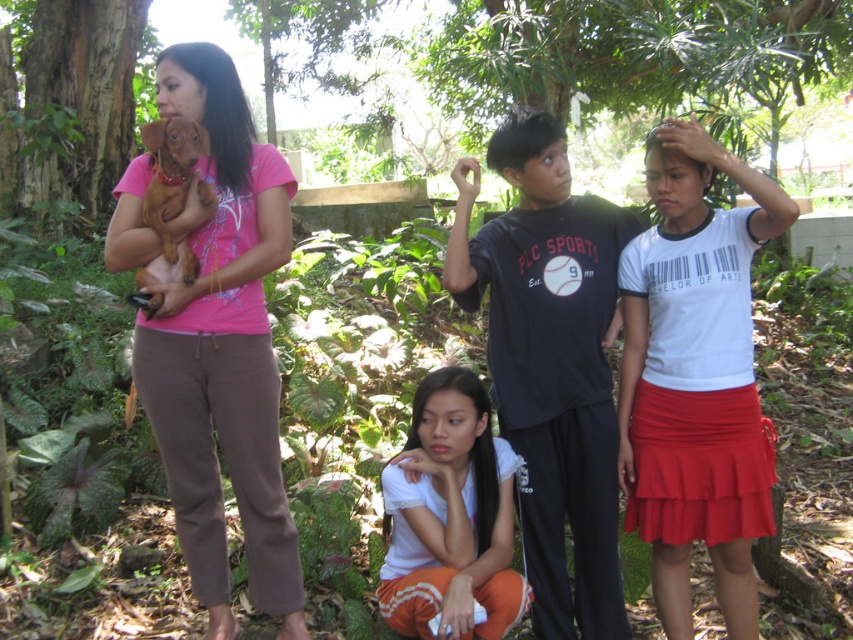
You are taking a photo of the group in the garden. You want to focus on the point at the bottom of the frame. Which point, point (x=164, y=419) or point (x=196, y=161), is closer to the bottom of the frame?

Point (x=196, y=161) is closer to the bottom of the frame because it has a lower y coordinate than point (x=164, y=419).

You are organizing a clothing donation drive and need to categorize shirts by size. You have two shirts in front of you, the white cotton shirt at center and the white matte shirt at lower center. Which shirt should you place in the large size bin?

The white cotton shirt at center is bigger than the white matte shirt at lower center, so you should place the white cotton shirt at center in the large size bin.

You are a photographer trying to capture a clear shot of both the pink matte shirt at left and the brown furry dog at left. Since the shirt and the dog are both on the left side, which one should you focus on first to ensure both are in frame?

The pink matte shirt at left is larger in size than the brown furry dog at left, so you should focus on the pink matte shirt at left first to ensure both fit within the frame.